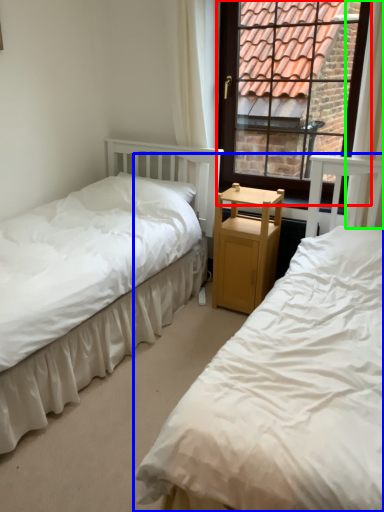
Question: Which object is the closest to the window (highlighted by a red box)? Choose among these: bed (highlighted by a blue box) or curtain (highlighted by a green box).

Choices:
 (A) bed
 (B) curtain

Answer: (B)